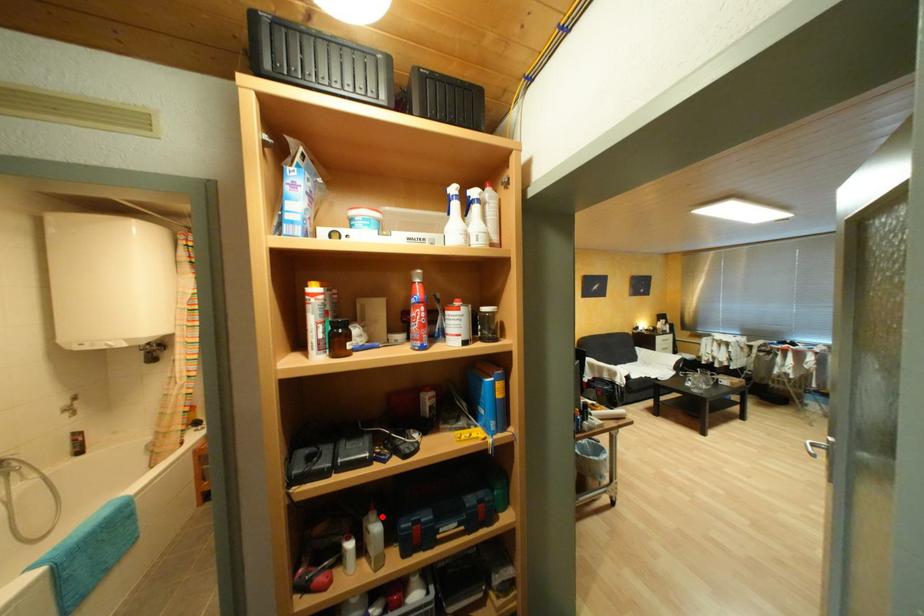
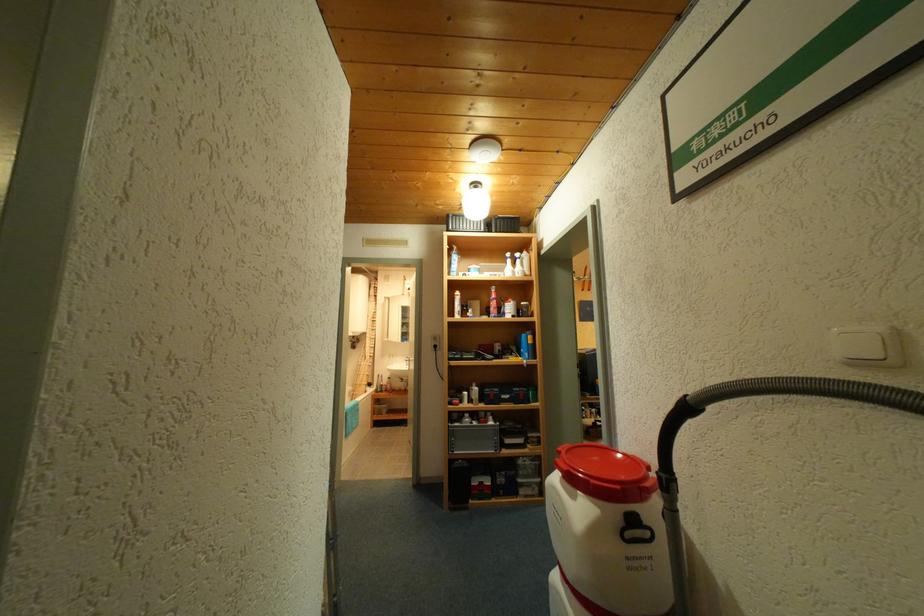
Question: A red point is marked in image1. In image2, is the corresponding 3D point closer to the camera or farther? Reply with the corresponding letter.

Choices:
 (A) The corresponding 3D point is closer.
 (B) The corresponding 3D point is farther.

Answer: (B)